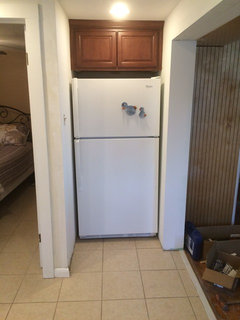
Where is `pillow`? This screenshot has width=240, height=320. pillow is located at coordinates (9, 135).